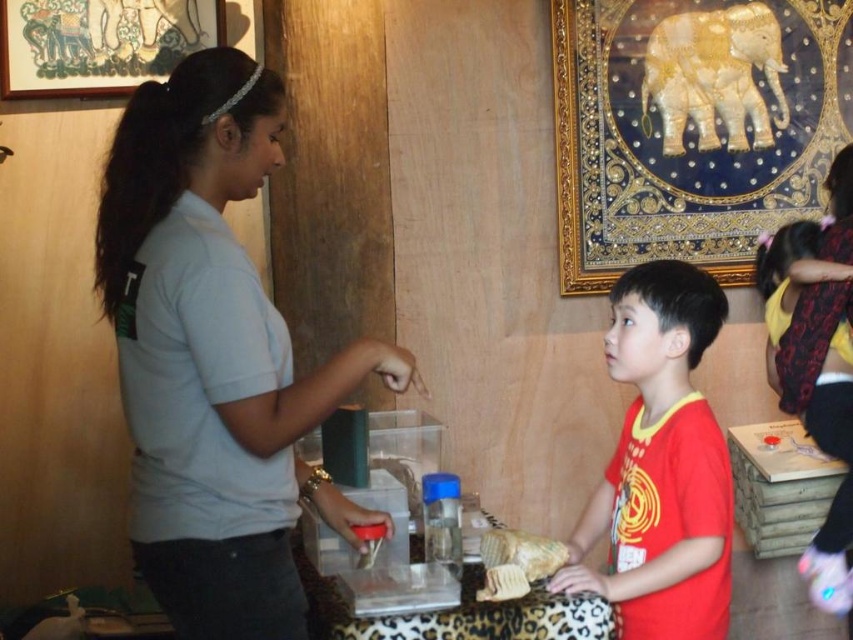
What is located at the coordinate point (213, 356) in the image?

The light gray shirt at center is located at the coordinate point (213, 356).

You are a customer in the shop and want to buy the golden textured bread at lower center. The red matte shirt at center is blocking your view. Can you see the bread through the shirt?

The red matte shirt at center is larger in size than golden textured bread at lower center, so it might block your view. However, since the shirt is made of a light gray material and the bread is at lower center, you might still see parts of the bread through the shirt if it is semi transparent.